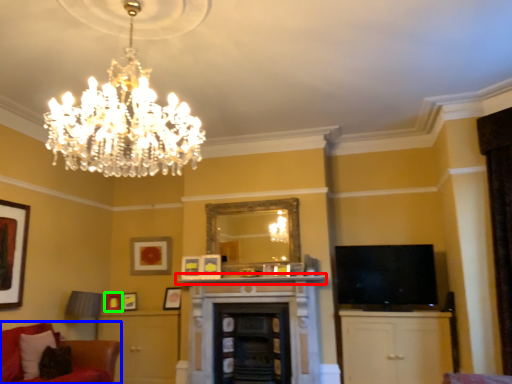
Question: Which object is the farthest from mantle (highlighted by a red box)? Choose among these: studio couch (highlighted by a blue box) or picture frame (highlighted by a green box).

Choices:
 (A) studio couch
 (B) picture frame

Answer: (A)